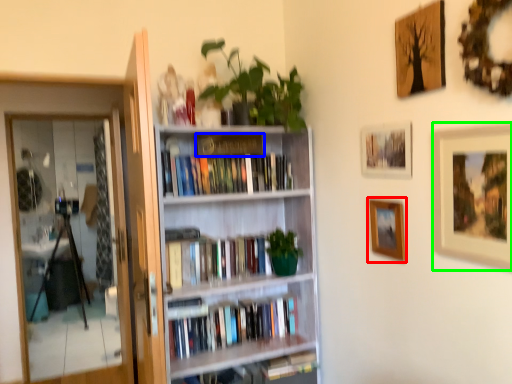
Question: Which object is the closest to the picture frame (highlighted by a red box)? Choose among these: paperback book (highlighted by a blue box) or picture frame (highlighted by a green box).

Choices:
 (A) paperback book
 (B) picture frame

Answer: (B)